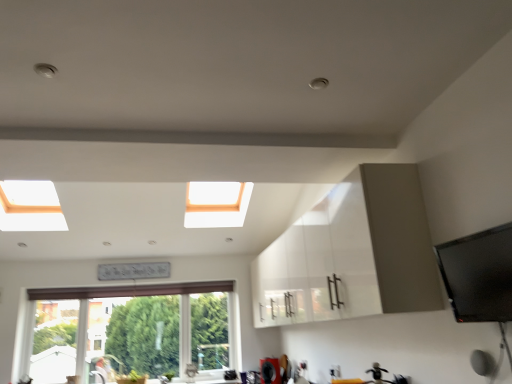
Question: Is white frame window at lower left next to white glossy cabinet at center and touching it?

Choices:
 (A) no
 (B) yes

Answer: (A)

Question: From a real-world perspective, is white frame window at lower left physically below white glossy cabinet at center?

Choices:
 (A) yes
 (B) no

Answer: (A)

Question: Does white frame window at lower left have a greater height compared to white glossy cabinet at center?

Choices:
 (A) no
 (B) yes

Answer: (B)

Question: Can you confirm if white frame window at lower left is shorter than white glossy cabinet at center?

Choices:
 (A) no
 (B) yes

Answer: (A)

Question: From the image's perspective, is white frame window at lower left located beneath white glossy cabinet at center?

Choices:
 (A) no
 (B) yes

Answer: (B)

Question: Is white frame window at lower left facing away from white glossy cabinet at center?

Choices:
 (A) no
 (B) yes

Answer: (A)

Question: Is white frame window at lower left facing towards matte silver faucet at lower center?

Choices:
 (A) no
 (B) yes

Answer: (B)

Question: Can you confirm if white frame window at lower left is taller than matte silver faucet at lower center?

Choices:
 (A) no
 (B) yes

Answer: (B)

Question: Is white frame window at lower left further to the viewer compared to matte silver faucet at lower center?

Choices:
 (A) yes
 (B) no

Answer: (A)

Question: Is white frame window at lower left far away from matte silver faucet at lower center?

Choices:
 (A) no
 (B) yes

Answer: (B)

Question: Is white frame window at lower left to the left of matte silver faucet at lower center from the viewer's perspective?

Choices:
 (A) yes
 (B) no

Answer: (A)

Question: Does white frame window at lower left have a lesser width compared to matte silver faucet at lower center?

Choices:
 (A) yes
 (B) no

Answer: (A)

Question: Is white frame window at lower left inside white glossy cabinet at center?

Choices:
 (A) yes
 (B) no

Answer: (B)